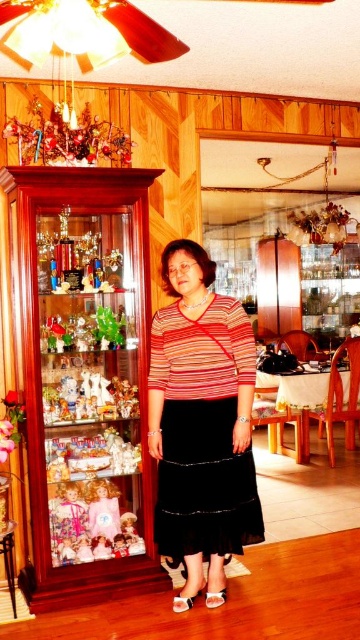
Question: Which object appears closest to the camera in this image?

Choices:
 (A) matte plastic doll at center
 (B) striped fabric shirt at center
 (C) translucent glass figurine at left

Answer: (B)

Question: Is matte plastic doll at center smaller than pastel pink fabric doll at center?

Choices:
 (A) yes
 (B) no

Answer: (B)

Question: Which object appears closest to the camera in this image?

Choices:
 (A) matte plastic dolls at center
 (B) matte plastic doll at center

Answer: (A)

Question: Is striped fabric shirt at center bigger than translucent glass figurine at left?

Choices:
 (A) yes
 (B) no

Answer: (A)

Question: Does matte plastic doll at center appear under translucent glass figurine at left?

Choices:
 (A) yes
 (B) no

Answer: (A)

Question: Which object appears farthest from the camera in this image?

Choices:
 (A) matte plastic dolls at center
 (B) pastel pink fabric doll at center
 (C) translucent glass figurine at left

Answer: (B)